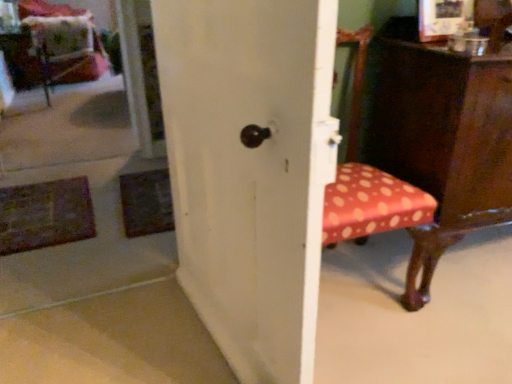
Question: Does velvet cushion at upper left have a lesser height compared to white matte door at center?

Choices:
 (A) yes
 (B) no

Answer: (A)

Question: Can you confirm if velvet cushion at upper left is thinner than white matte door at center?

Choices:
 (A) no
 (B) yes

Answer: (A)

Question: Is velvet cushion at upper left outside white matte door at center?

Choices:
 (A) no
 (B) yes

Answer: (B)

Question: Can you confirm if velvet cushion at upper left is bigger than white matte door at center?

Choices:
 (A) no
 (B) yes

Answer: (B)

Question: Could you tell me if velvet cushion at upper left is turned towards white matte door at center?

Choices:
 (A) yes
 (B) no

Answer: (B)

Question: From a real-world perspective, is white matte door at center above or below velvet cushion at upper left?

Choices:
 (A) above
 (B) below

Answer: (A)

Question: Is white matte door at center inside or outside of velvet cushion at upper left?

Choices:
 (A) inside
 (B) outside

Answer: (B)

Question: Looking at their shapes, would you say white matte door at center is wider or thinner than velvet cushion at upper left?

Choices:
 (A) wide
 (B) thin

Answer: (B)

Question: Considering the relative positions of white matte door at center and velvet cushion at upper left in the image provided, is white matte door at center to the left or to the right of velvet cushion at upper left?

Choices:
 (A) left
 (B) right

Answer: (B)

Question: Considering the positions of velvet polka dot swivel chair at upper left and white matte door at center in the image, is velvet polka dot swivel chair at upper left bigger or smaller than white matte door at center?

Choices:
 (A) small
 (B) big

Answer: (B)

Question: From a real-world perspective, relative to white matte door at center, is velvet polka dot swivel chair at upper left vertically above or below?

Choices:
 (A) above
 (B) below

Answer: (B)

Question: Considering the positions of velvet polka dot swivel chair at upper left and white matte door at center in the image, is velvet polka dot swivel chair at upper left taller or shorter than white matte door at center?

Choices:
 (A) short
 (B) tall

Answer: (A)

Question: Is velvet polka dot swivel chair at upper left in front of or behind white matte door at center in the image?

Choices:
 (A) behind
 (B) front

Answer: (A)

Question: Looking at their shapes, would you say velvet cushion at upper left is wider or thinner than polka dot fabric chair at right?

Choices:
 (A) wide
 (B) thin

Answer: (A)

Question: Relative to polka dot fabric chair at right, is velvet cushion at upper left in front or behind?

Choices:
 (A) behind
 (B) front

Answer: (A)